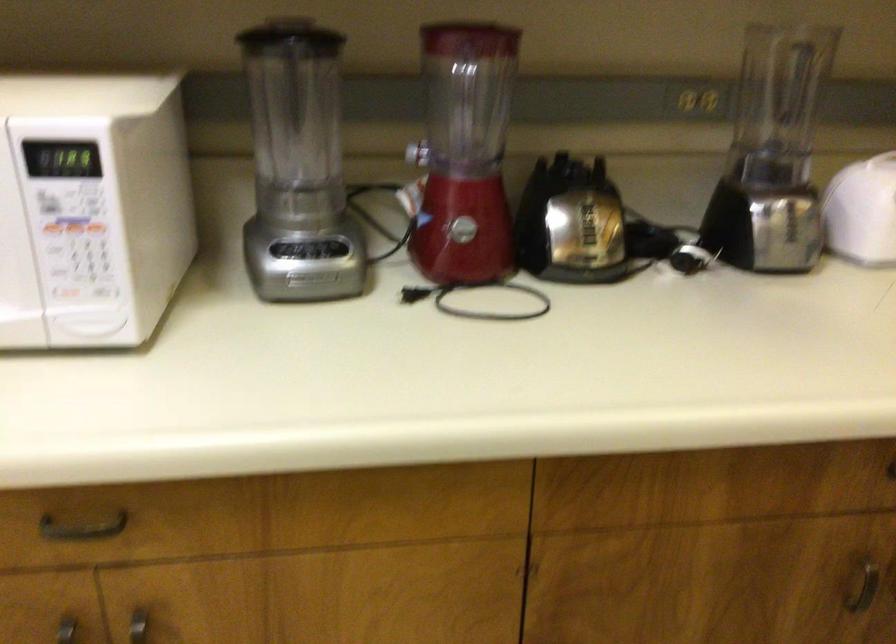
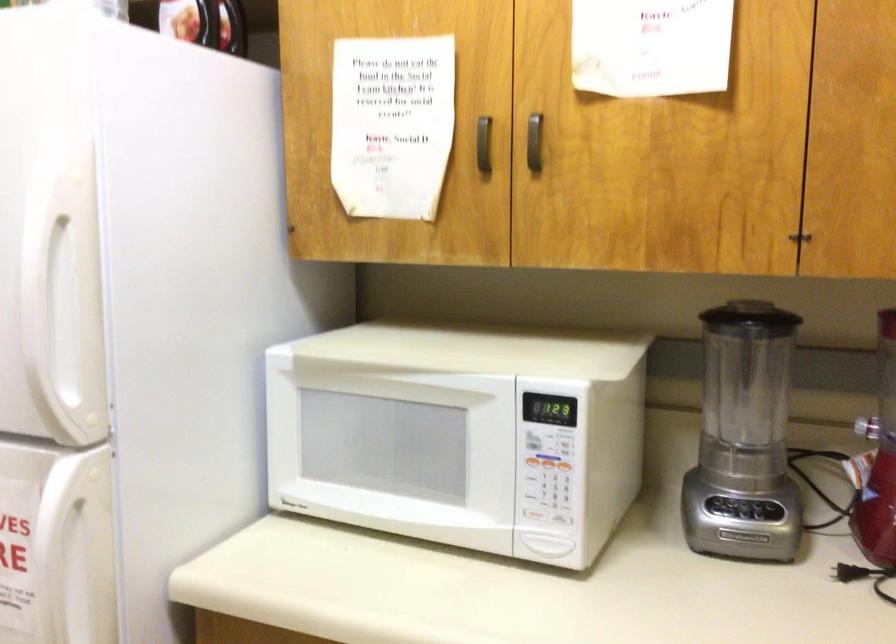
Locate, in the second image, the point that corresponds to the point at 91,227 in the first image.

(565, 467)